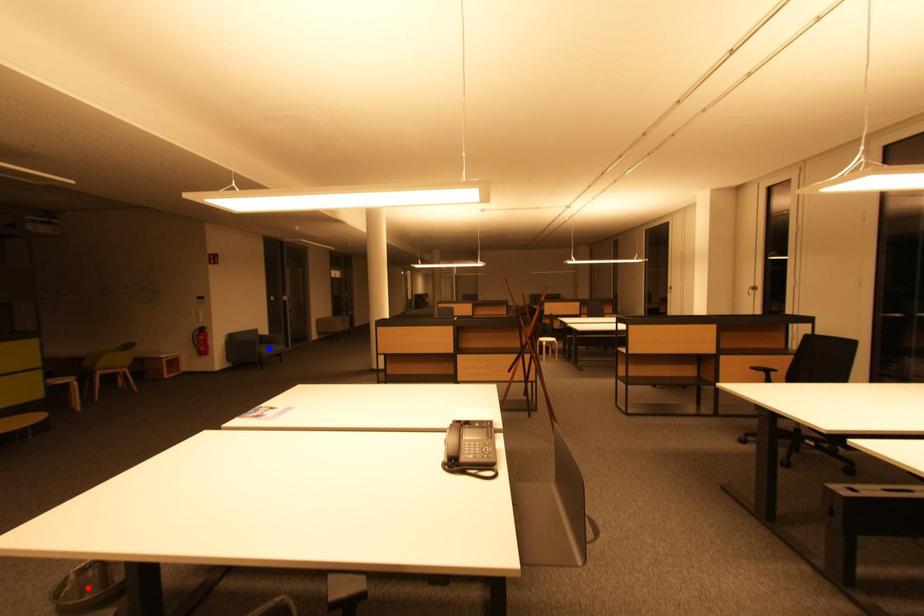
Question: In the image, two points are highlighted. Which point is nearer to the camera? Reply with the corresponding letter.

Choices:
 (A) blue point
 (B) red point

Answer: (B)